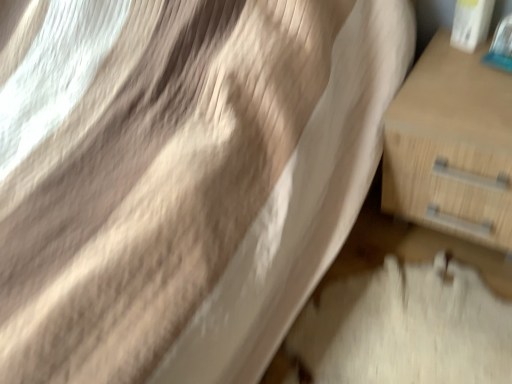
In order to face light wood drawer at right, should I rotate leftwards or rightwards?

To align with it, rotate right about 27.276°.

What do you see at coordinates (451, 146) in the screenshot? Image resolution: width=512 pixels, height=384 pixels. I see `light wood drawer at right` at bounding box center [451, 146].

This screenshot has width=512, height=384. Identify the location of light wood drawer at right. pos(451,146).

You are a GUI agent. You are given a task and a screenshot of the screen. Output one action in this format:
    pyautogui.click(x=<x>, y=<y>)
    Task: Click on the light wood drawer at right
    The image size is (512, 384).
    Given the screenshot: What is the action you would take?
    pyautogui.click(x=451, y=146)